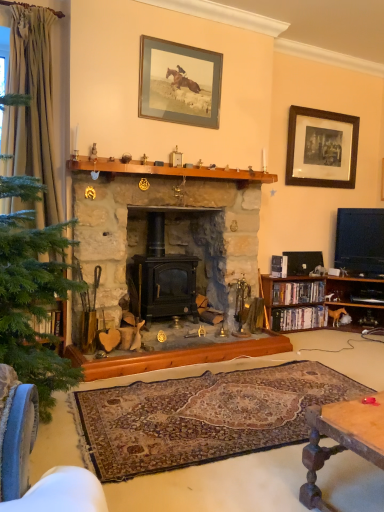
Question: Is wooden bookshelf at right oriented away from black stone fireplace at center?

Choices:
 (A) yes
 (B) no

Answer: (B)

Question: Can you confirm if wooden bookshelf at right is smaller than black stone fireplace at center?

Choices:
 (A) no
 (B) yes

Answer: (B)

Question: Could you tell me if wooden bookshelf at right is turned towards black stone fireplace at center?

Choices:
 (A) no
 (B) yes

Answer: (A)

Question: Is wooden bookshelf at right bigger than black stone fireplace at center?

Choices:
 (A) yes
 (B) no

Answer: (B)

Question: From the image's perspective, is wooden bookshelf at right located beneath black stone fireplace at center?

Choices:
 (A) yes
 (B) no

Answer: (A)

Question: In terms of size, does wooden bookshelf at right appear bigger or smaller than matte glass picture frame at upper center, the 2th picture frame in the right-to-left sequence?

Choices:
 (A) big
 (B) small

Answer: (A)

Question: Considering their positions, is wooden bookshelf at right located in front of or behind matte glass picture frame at upper center, the 2th picture frame from the back?

Choices:
 (A) front
 (B) behind

Answer: (B)

Question: Is point (292, 308) positioned closer to the camera than point (140, 105)?

Choices:
 (A) farther
 (B) closer

Answer: (A)

Question: In the image, is wooden bookshelf at right on the left side or the right side of matte glass picture frame at upper center, the 1th picture frame from the left?

Choices:
 (A) left
 (B) right

Answer: (B)

Question: From a real-world perspective, is black plastic phone at lower right above or below wooden bookshelf at right?

Choices:
 (A) above
 (B) below

Answer: (A)

Question: From the image's perspective, is black plastic phone at lower right located above or below wooden bookshelf at right?

Choices:
 (A) above
 (B) below

Answer: (A)

Question: In terms of width, does black plastic phone at lower right look wider or thinner when compared to wooden bookshelf at right?

Choices:
 (A) wide
 (B) thin

Answer: (B)

Question: Based on their positions, is black plastic phone at lower right located to the left or right of wooden bookshelf at right?

Choices:
 (A) left
 (B) right

Answer: (A)

Question: Is black wood picture frame at upper right, which ranks as the 1th picture frame in back-to-front order, inside or outside of black stone fireplace at center?

Choices:
 (A) inside
 (B) outside

Answer: (B)

Question: Considering the positions of black wood picture frame at upper right, which is counted as the second picture frame, starting from the front, and black stone fireplace at center in the image, is black wood picture frame at upper right, which is counted as the second picture frame, starting from the front, wider or thinner than black stone fireplace at center?

Choices:
 (A) thin
 (B) wide

Answer: (A)